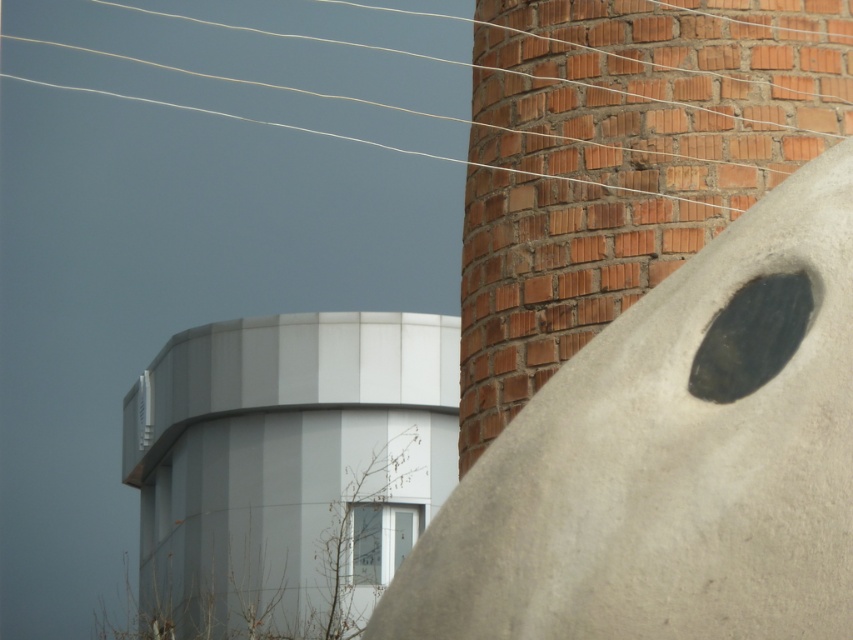
In the scene shown: Is smooth concrete sculpture at center further to camera compared to brick chimney at center?

No, it is not.

Does smooth concrete sculpture at center appear on the right side of brick chimney at center?

Correct, you'll find smooth concrete sculpture at center to the right of brick chimney at center.

At what (x,y) coordinates should I click in order to perform the action: click on smooth concrete sculpture at center. Please return your answer as a coordinate pair (x, y). This screenshot has height=640, width=853. Looking at the image, I should click on (672, 458).

Can you confirm if brick chimney at center is thinner than white smooth tower at center?

Indeed, brick chimney at center has a lesser width compared to white smooth tower at center.

Is point (474, 116) less distant than point (405, 477)?

That is True.

Locate an element on the screen. This screenshot has width=853, height=640. brick chimney at center is located at coordinates (619, 163).

Is smooth concrete sculpture at center smaller than white smooth tower at center?

Yes, smooth concrete sculpture at center is smaller than white smooth tower at center.

Between point (606, 358) and point (305, 445), which one is positioned in front?

Positioned in front is point (606, 358).

Between point (845, 173) and point (287, 344), which one is positioned behind?

Point (287, 344)

You are a GUI agent. You are given a task and a screenshot of the screen. Output one action in this format:
    pyautogui.click(x=<x>, y=<y>)
    Task: Click on the smooth concrete sculpture at center
    
    Given the screenshot: What is the action you would take?
    pyautogui.click(x=672, y=458)